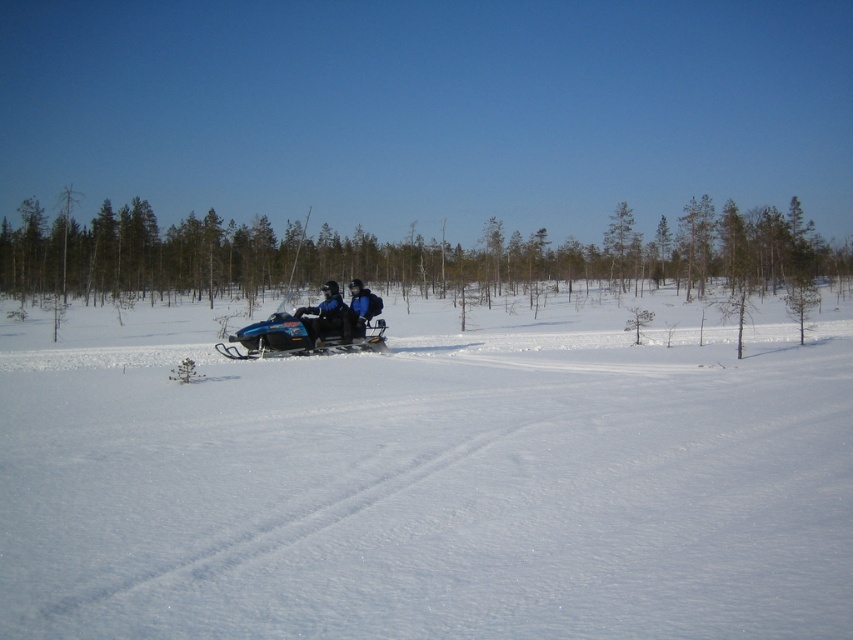
Image resolution: width=853 pixels, height=640 pixels. I want to click on brown wood tree at center, so click(404, 257).

How distant is brown wood tree at center from blue fabric jacket at center?

The distance of brown wood tree at center from blue fabric jacket at center is 172.08 feet.

Where is `brown wood tree at center`? The height and width of the screenshot is (640, 853). brown wood tree at center is located at coordinates (404, 257).

What do you see at coordinates (425, 484) in the screenshot? The width and height of the screenshot is (853, 640). I see `white powdery snow at center` at bounding box center [425, 484].

Is white powdery snow at center in front of brown wood tree at center?

That is True.

Which is behind, point (196, 465) or point (215, 292)?

Point (215, 292)

Where is `white powdery snow at center`? The width and height of the screenshot is (853, 640). white powdery snow at center is located at coordinates (425, 484).

Does white powdery snow at center have a smaller size compared to blue fabric jacket at center?

Incorrect, white powdery snow at center is not smaller in size than blue fabric jacket at center.

What do you see at coordinates (425, 484) in the screenshot? Image resolution: width=853 pixels, height=640 pixels. I see `white powdery snow at center` at bounding box center [425, 484].

Which is in front, point (680, 368) or point (335, 300)?

Point (680, 368) is in front.

Locate an element on the screen. The height and width of the screenshot is (640, 853). white powdery snow at center is located at coordinates (425, 484).